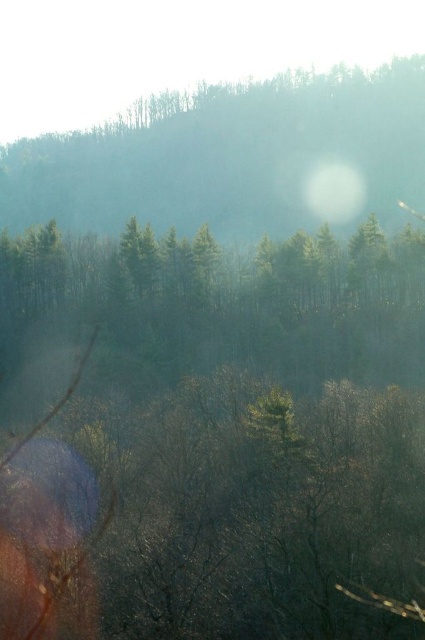
You are a hiker trying to navigate through the forest. You see the green matte trees at center and the green matte hillside at upper center. Which one is closer to you?

The green matte trees at center are closer to you because they are positioned under the green matte hillside at upper center, indicating they are in a lower layer of the scene.

You are a hiker trying to navigate through the forest. You see the green matte trees at center and the green matte hillside at upper center. Which one is closer to you?

The green matte trees at center are closer to you because they are positioned in front of the green matte hillside at upper center.